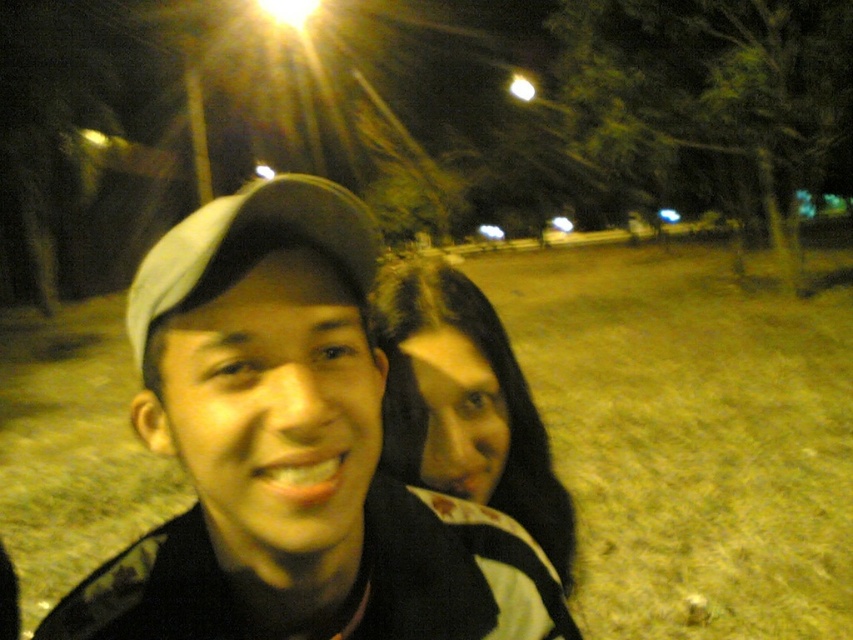
Is matte black cap at center in front of dark brown hair at center?

Yes, it is in front of dark brown hair at center.

Does point (219, 476) come closer to viewer compared to point (474, 342)?

That is True.

At what (x,y) coordinates should I click in order to perform the action: click on matte black cap at center. Please return your answer as a coordinate pair (x, y). Looking at the image, I should click on (291, 452).